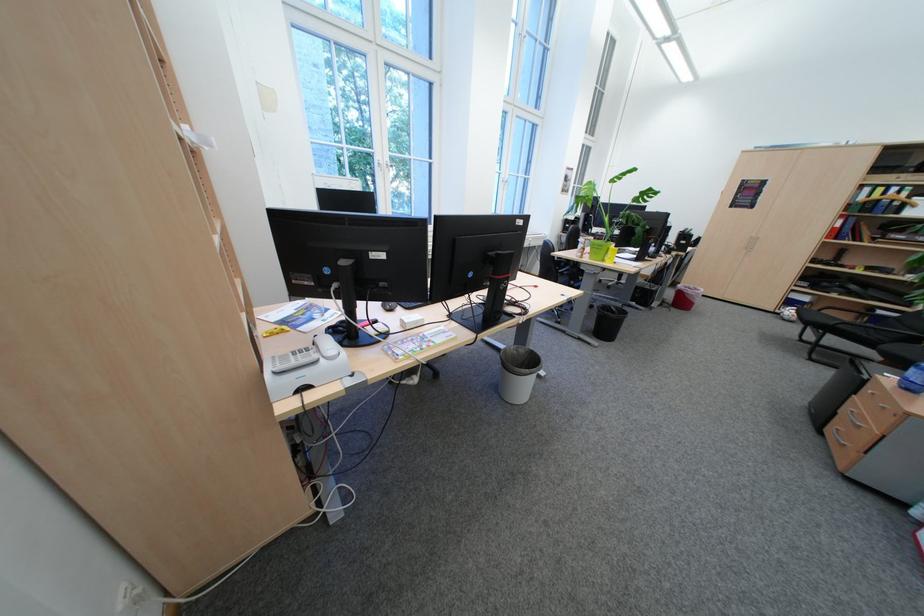
Identify the location of black computer mouse. The image size is (924, 616). (388, 307).